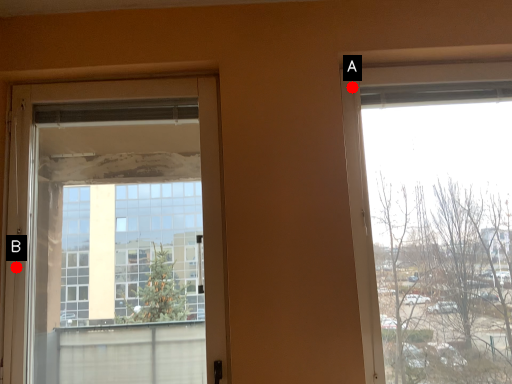
Question: Two points are circled on the image, labeled by A and B beside each circle. Among these points, which one is farthest from the camera?

Choices:
 (A) A is further
 (B) B is further

Answer: (A)